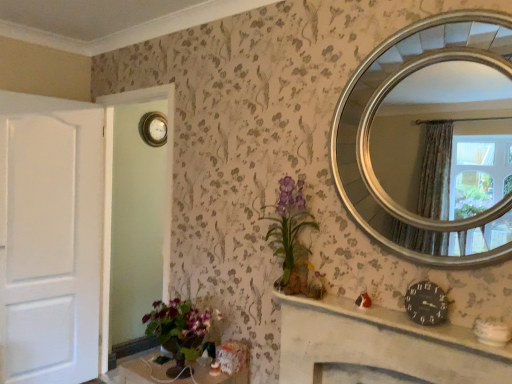
Question: Is matte purple vase at center bigger or smaller than white matte door at left?

Choices:
 (A) big
 (B) small

Answer: (B)

Question: Is point (289, 231) closer or farther from the camera than point (80, 107)?

Choices:
 (A) closer
 (B) farther

Answer: (A)

Question: Which is nearer to the wooden table at lower left?

Choices:
 (A) matte purple vase at center
 (B) white matte door at left
 (C) gold metallic clock at upper left
 (D) black clock at center
 (E) metallic round clock at upper center, the 2th clock viewed from the front

Answer: (D)

Question: Based on their relative distances, which object is nearer to the white matte door at left?

Choices:
 (A) silver/golden mirror at upper right
 (B) gold metallic clock at upper left
 (C) metallic round clock at upper center, which is counted as the 2th clock, starting from the right
 (D) matte purple vase at center
 (E) wooden table at lower left

Answer: (B)